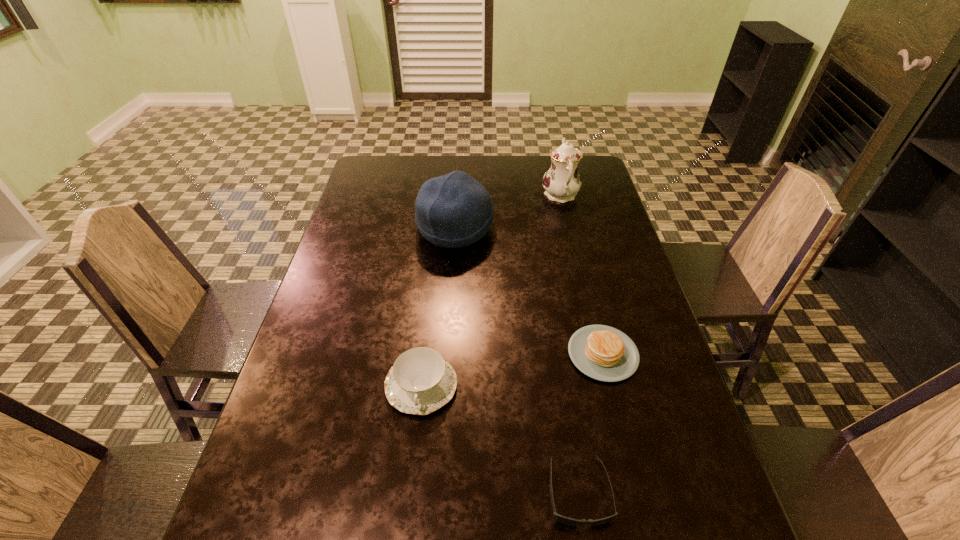
Find the location of a particular element. unoccupied area between the farther chinaware and the skullcap is located at coordinates (508, 211).

This screenshot has width=960, height=540. I want to click on unoccupied area between the nearest object and the pancake, so click(x=590, y=422).

This screenshot has width=960, height=540. I want to click on unoccupied area between the shorter chinaware and the skullcap, so click(439, 306).

Where is `blank region between the fourth tallest object and the sunglasses`? blank region between the fourth tallest object and the sunglasses is located at coordinates (590, 422).

Image resolution: width=960 pixels, height=540 pixels. What are the coordinates of `free space between the shortest object and the fourth tallest object` in the screenshot? It's located at (590, 422).

Locate an element on the screen. unoccupied position between the pancake and the right chinaware is located at coordinates (582, 274).

Locate which object is the closest to the shortest object. Please provide its 2D coordinates. Your answer should be formatted as a tuple, i.e. [(x, y)], where the tuple contains the x and y coordinates of a point satisfying the conditions above.

[(604, 353)]

Locate an element on the screen. Image resolution: width=960 pixels, height=540 pixels. object that is the nearest to the shortest object is located at coordinates (604, 353).

Identify the location of free space in the image that satisfies the following two spatial constraints: 1. on the front side of the right chinaware; 2. on the left side of the pancake. This screenshot has height=540, width=960. (598, 354).